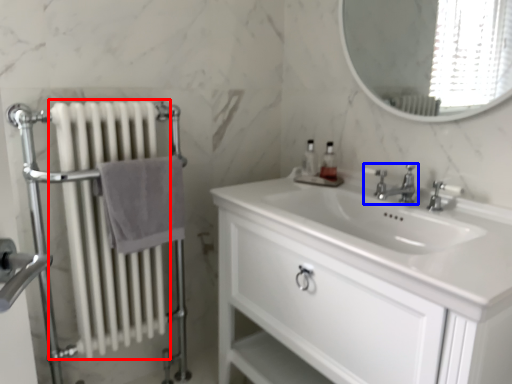
Question: Which object appears farthest to the camera in this image, radiator (highlighted by a red box) or tap (highlighted by a blue box)?

Choices:
 (A) radiator
 (B) tap

Answer: (B)